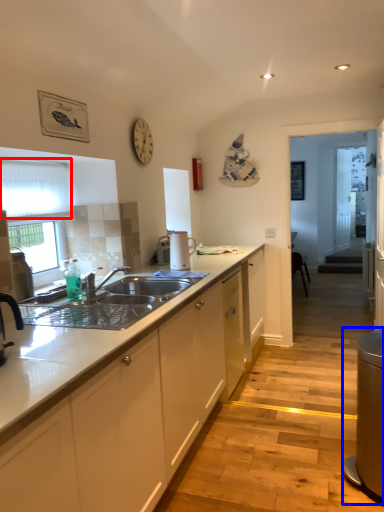
Question: Among these objects, which one is farthest to the camera, window screen (highlighted by a red box) or appliance (highlighted by a blue box)?

Choices:
 (A) window screen
 (B) appliance

Answer: (A)